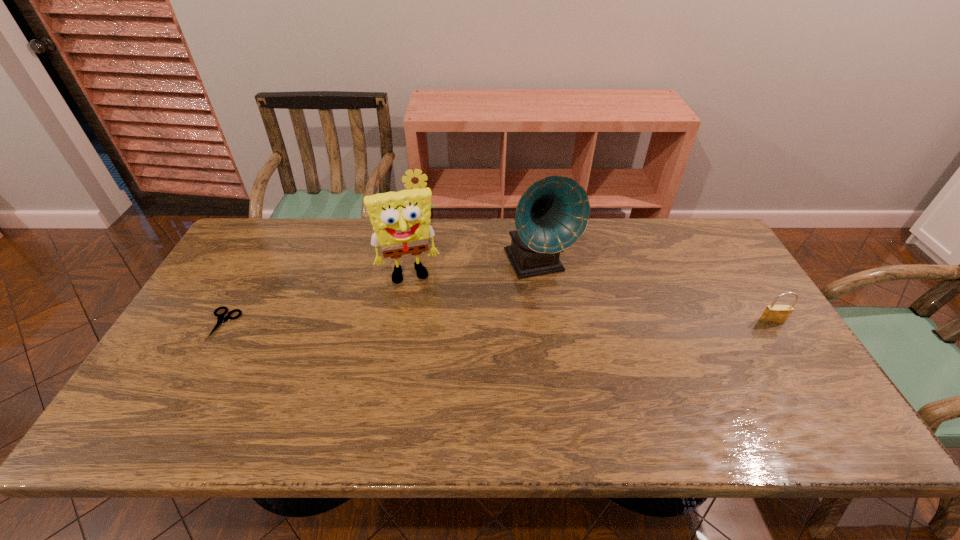
The width and height of the screenshot is (960, 540). Find the location of `shears`. shears is located at coordinates 221,319.

I want to click on the shortest object, so click(x=221, y=319).

Find the location of a particular element. the rightmost object is located at coordinates (773, 314).

Identify the location of padlock. The image size is (960, 540). (773, 314).

At what (x,y) coordinates should I click in order to perform the action: click on the second object from right to left. Please return your answer as a coordinate pair (x, y). The height and width of the screenshot is (540, 960). Looking at the image, I should click on tap(553, 213).

You are a GUI agent. You are given a task and a screenshot of the screen. Output one action in this format:
    pyautogui.click(x=<x>, y=<y>)
    Task: Click on the tallest object
    
    Given the screenshot: What is the action you would take?
    [x=553, y=213]

Locate an element on the screen. This screenshot has height=540, width=960. sunflower is located at coordinates (418, 179).

Locate an element on the screen. the farthest object is located at coordinates (418, 179).

The height and width of the screenshot is (540, 960). I want to click on sponge, so click(x=401, y=220).

The height and width of the screenshot is (540, 960). I want to click on vacant space located 0.170m on the front of the shortest object, so click(182, 397).